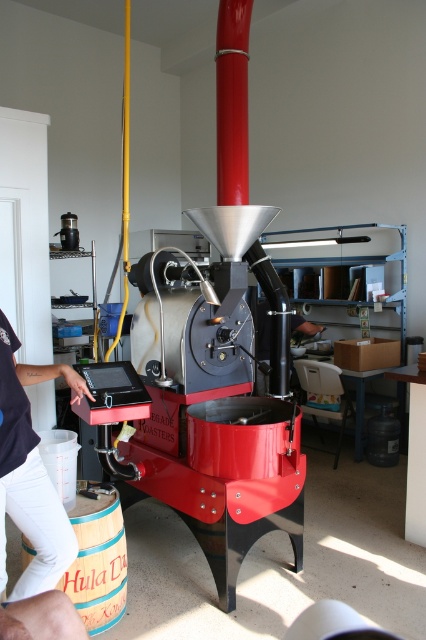
Is point (11, 512) behind point (75, 524)?

No, it is in front of (75, 524).

Is dark blue shirt at left taller than wooden barrel at lower left?

Yes.

Which is in front, point (16, 388) or point (120, 588)?

Positioned in front is point (16, 388).

You are a GUI agent. You are given a task and a screenshot of the screen. Output one action in this format:
    pyautogui.click(x=<x>, y=<y>)
    Task: Click on the dark blue shirt at left
    This screenshot has width=426, height=640.
    Given the screenshot: What is the action you would take?
    pyautogui.click(x=29, y=472)